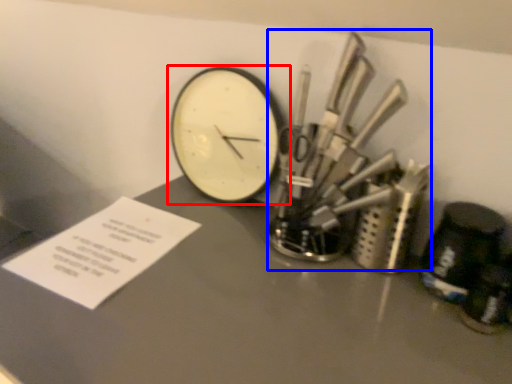
Question: Which object is further to the camera taking this photo, wall clock (highlighted by a red box) or tool (highlighted by a blue box)?

Choices:
 (A) wall clock
 (B) tool

Answer: (A)